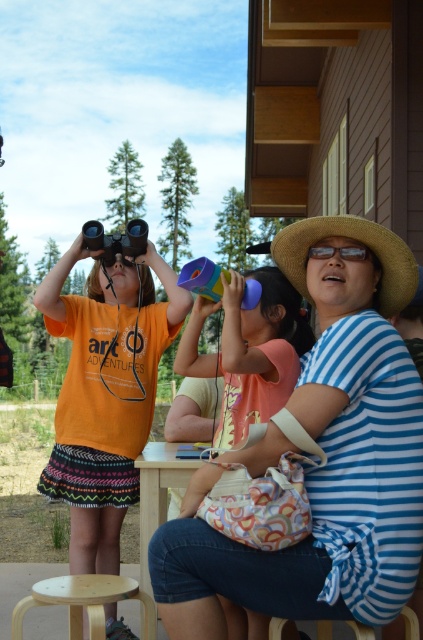
Question: Based on their relative distances, which object is nearer to the orange matte shirt at left?

Choices:
 (A) matte plastic binoculars at center
 (B) wooden table at center

Answer: (B)

Question: In this image, where is orange matte shirt at left located relative to straw hat at right?

Choices:
 (A) below
 (B) above

Answer: (A)

Question: Does orange matte shirt at left appear on the right side of straw hat at right?

Choices:
 (A) yes
 (B) no

Answer: (B)

Question: Which of the following is the closest to the observer?

Choices:
 (A) blue striped shirt at center
 (B) orange matte shirt at left
 (C) wooden stool at lower center
 (D) wooden table at center

Answer: (A)

Question: In this image, where is blue striped shirt at center located relative to orange matte shirt at left?

Choices:
 (A) left
 (B) right

Answer: (B)

Question: Which point appears farthest from the camera in this image?

Choices:
 (A) (191, 465)
 (B) (285, 300)
 (C) (403, 612)

Answer: (A)